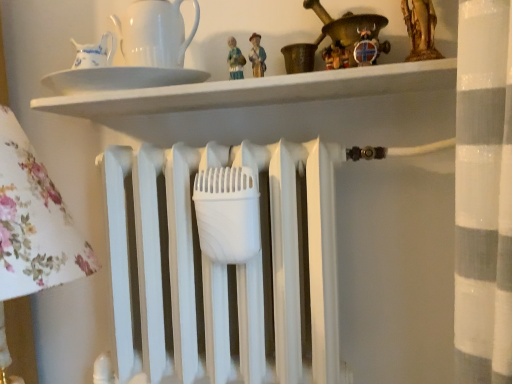
What do you see at coordinates (348, 35) in the screenshot?
I see `wooden viking helmet at upper center` at bounding box center [348, 35].

The width and height of the screenshot is (512, 384). What are the coordinates of `wooden viking helmet at upper center` in the screenshot? It's located at (348, 35).

Identify the location of wooden viking helmet at upper center. Image resolution: width=512 pixels, height=384 pixels. (348, 35).

Could you tell me if white glossy pitcher at upper left is facing white glossy plate at upper center?

No, white glossy pitcher at upper left is not turned towards white glossy plate at upper center.

Can you confirm if white glossy pitcher at upper left is wider than white glossy plate at upper center?

No, white glossy pitcher at upper left is not wider than white glossy plate at upper center.

Is white glossy pitcher at upper left behind white glossy plate at upper center?

Yes, white glossy pitcher at upper left is behind white glossy plate at upper center.

Is white glossy pitcher at upper left at the left side of white glossy plate at upper center?

Yes, white glossy pitcher at upper left is to the left of white glossy plate at upper center.

Which of these two, wooden viking helmet at upper center or white glossy plate at upper center, is thinner?

With smaller width is wooden viking helmet at upper center.

Is wooden viking helmet at upper center positioned with its back to white glossy plate at upper center?

wooden viking helmet at upper center is not turned away from white glossy plate at upper center.

Is wooden viking helmet at upper center in front of or behind white glossy plate at upper center in the image?

wooden viking helmet at upper center is positioned farther from the viewer than white glossy plate at upper center.

From the image's perspective, between wooden viking helmet at upper center and white glossy plate at upper center, who is located below?

white glossy plate at upper center.

Can you tell me how much wooden viking helmet at upper center and white glossy pitcher at upper left differ in facing direction?

0.00402 degrees.

Is the surface of wooden viking helmet at upper center in direct contact with white glossy pitcher at upper left?

No, wooden viking helmet at upper center is not making contact with white glossy pitcher at upper left.

Considering the relative sizes of wooden viking helmet at upper center and white glossy pitcher at upper left in the image provided, is wooden viking helmet at upper center bigger than white glossy pitcher at upper left?

Correct, wooden viking helmet at upper center is larger in size than white glossy pitcher at upper left.

How different are the orientations of white glossy pitcher at upper left and wooden viking helmet at upper center in degrees?

The facing directions of white glossy pitcher at upper left and wooden viking helmet at upper center are 0.00402 degrees apart.

Is point (122, 84) closer or farther from the camera than point (330, 36)?

Point (122, 84) appears to be closer to the viewer than point (330, 36).

Between white glossy pitcher at upper left and wooden viking helmet at upper center, which one has larger size?

wooden viking helmet at upper center.

How distant is white glossy plate at upper center from white glossy pitcher at upper left?

white glossy plate at upper center is 15.11 centimeters from white glossy pitcher at upper left.

Can you confirm if white glossy plate at upper center is positioned to the left of white glossy pitcher at upper left?

Incorrect, white glossy plate at upper center is not on the left side of white glossy pitcher at upper left.

In the scene shown: Is white glossy plate at upper center touching white glossy pitcher at upper left?

white glossy plate at upper center and white glossy pitcher at upper left are not in contact.

From the picture: Is white glossy plate at upper center next to wooden viking helmet at upper center?

No, white glossy plate at upper center is not with wooden viking helmet at upper center.

Is point (256, 104) in front of point (377, 34)?

No.

Looking at this image, is white glossy plate at upper center at the right side of wooden viking helmet at upper center?

No.

Which is behind, white glossy plate at upper center or wooden viking helmet at upper center?

wooden viking helmet at upper center.

This screenshot has height=384, width=512. I want to click on shelf to the right of white glossy pitcher at upper left, so click(x=259, y=90).

Locate an element on the screen. The height and width of the screenshot is (384, 512). shelf on the left of wooden viking helmet at upper center is located at coordinates (259, 90).

Which object lies nearer to the anchor point wooden viking helmet at upper center, white glossy plate at upper center or white glossy pitcher at upper left?

Among the two, white glossy plate at upper center is located nearer to wooden viking helmet at upper center.

Based on their spatial positions, is white glossy plate at upper center or wooden viking helmet at upper center closer to white glossy pitcher at upper left?

The object closer to white glossy pitcher at upper left is white glossy plate at upper center.

Which object lies further to the anchor point white glossy plate at upper center, white glossy pitcher at upper left or wooden viking helmet at upper center?

The object further to white glossy plate at upper center is wooden viking helmet at upper center.

Based on their spatial positions, is wooden viking helmet at upper center or white glossy plate at upper center further from white glossy pitcher at upper left?

→ wooden viking helmet at upper center lies further to white glossy pitcher at upper left than the other object.

Considering their positions, is white glossy pitcher at upper left positioned further to wooden viking helmet at upper center than white glossy plate at upper center?

white glossy pitcher at upper left is further to wooden viking helmet at upper center.

Estimate the real-world distances between objects in this image. Which object is further from white glossy plate at upper center, wooden viking helmet at upper center or white glossy pitcher at upper left?

wooden viking helmet at upper center lies further to white glossy plate at upper center than the other object.

Where is `shelf located between white glossy pitcher at upper left and wooden viking helmet at upper center in the left-right direction`? shelf located between white glossy pitcher at upper left and wooden viking helmet at upper center in the left-right direction is located at coordinates (259, 90).